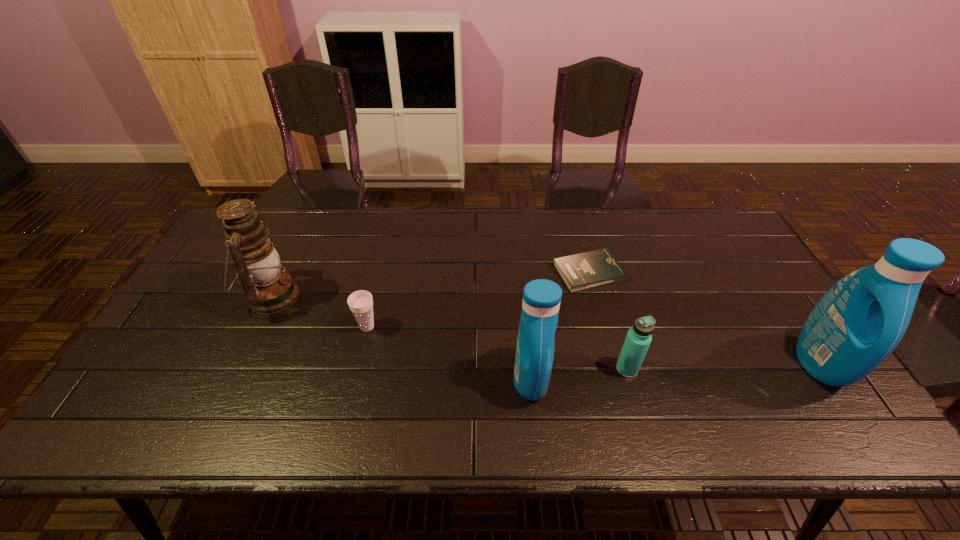
The width and height of the screenshot is (960, 540). What are the coordinates of `the shorter detergent` in the screenshot? It's located at [534, 356].

Where is `the left detergent`? The width and height of the screenshot is (960, 540). the left detergent is located at coordinates (534, 356).

The width and height of the screenshot is (960, 540). In order to click on the taller detergent in this screenshot , I will do `click(859, 321)`.

Where is `the right detergent`? the right detergent is located at coordinates (859, 321).

The height and width of the screenshot is (540, 960). What are the coordinates of `book` in the screenshot? It's located at (587, 270).

I want to click on cup, so click(360, 302).

This screenshot has height=540, width=960. I want to click on the second shortest object, so click(360, 302).

The width and height of the screenshot is (960, 540). I want to click on lantern, so click(269, 290).

Find the location of a particular element. thermos bottle is located at coordinates (638, 339).

What are the coordinates of `vacant space situated on the front-facing side of the fourth object from right to left` in the screenshot? It's located at (581, 379).